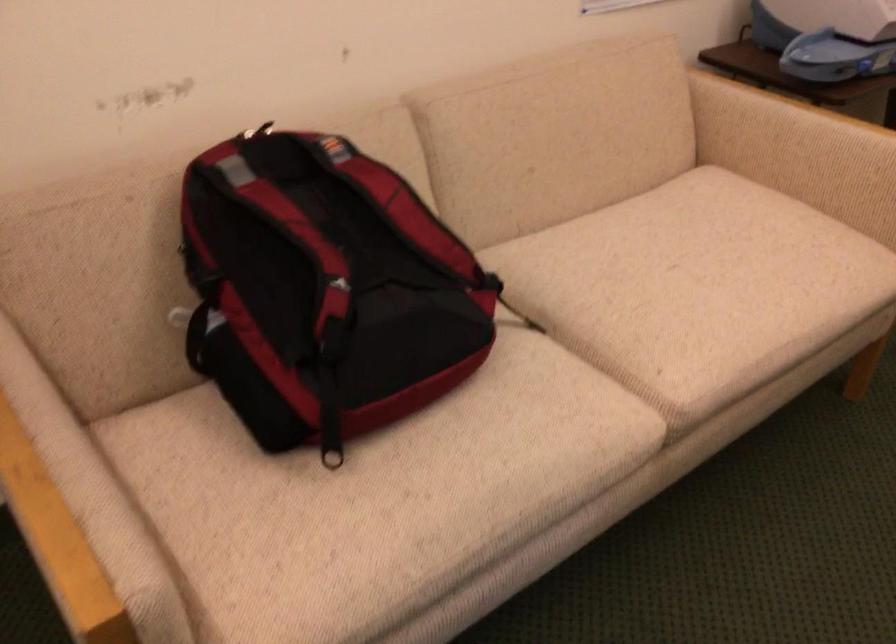
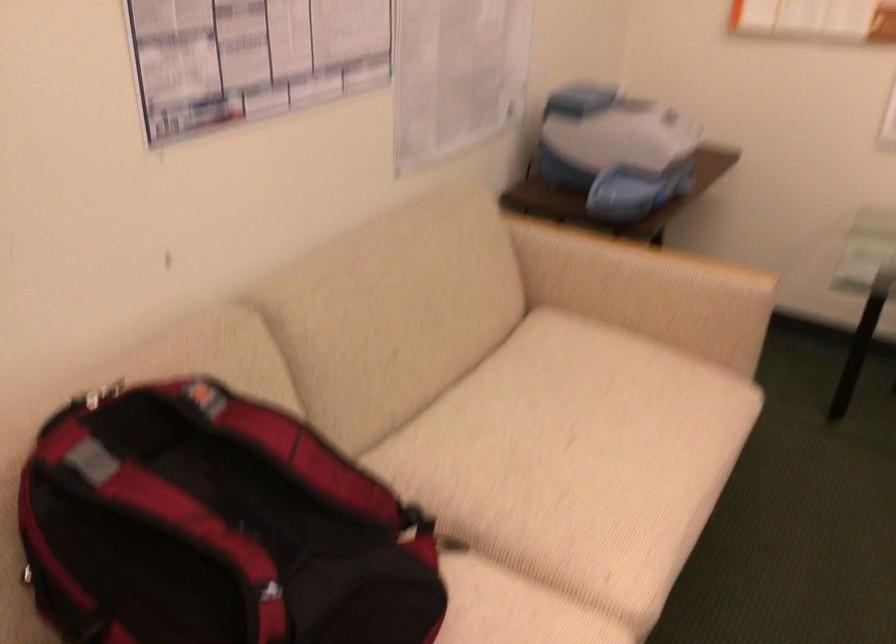
Question: The camera is either moving clockwise (left) or counter-clockwise (right) around the object. The first image is from the beginning of the video and the second image is from the end. Is the camera moving left or right when shooting the video?

Choices:
 (A) Left
 (B) Right

Answer: (A)